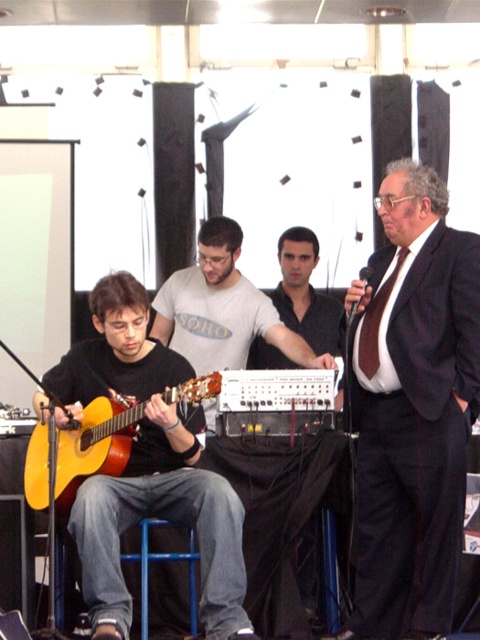
Does dark brown suit at center have a larger size compared to matte gray shirt at center?

Yes.

Is dark brown suit at center taller than matte gray shirt at center?

Indeed, dark brown suit at center has a greater height compared to matte gray shirt at center.

You are a GUI agent. You are given a task and a screenshot of the screen. Output one action in this format:
    pyautogui.click(x=<x>, y=<y>)
    Task: Click on the dark brown suit at center
    
    Given the screenshot: What is the action you would take?
    pyautogui.click(x=412, y=408)

Does matte gray shirt at center appear on the right side of acoustic wood guitar at left?

Indeed, matte gray shirt at center is positioned on the right side of acoustic wood guitar at left.

Is matte gray shirt at center closer to camera compared to acoustic wood guitar at left?

No, it is behind acoustic wood guitar at left.

This screenshot has height=640, width=480. Describe the element at coordinates (222, 308) in the screenshot. I see `matte gray shirt at center` at that location.

Locate an element on the screen. The width and height of the screenshot is (480, 640). matte gray shirt at center is located at coordinates (222, 308).

I want to click on dark brown suit at center, so click(412, 408).

Does dark brown suit at center lie in front of matte brown guitar at left?

That is False.

Find the location of a particular element. The width and height of the screenshot is (480, 640). dark brown suit at center is located at coordinates (412, 408).